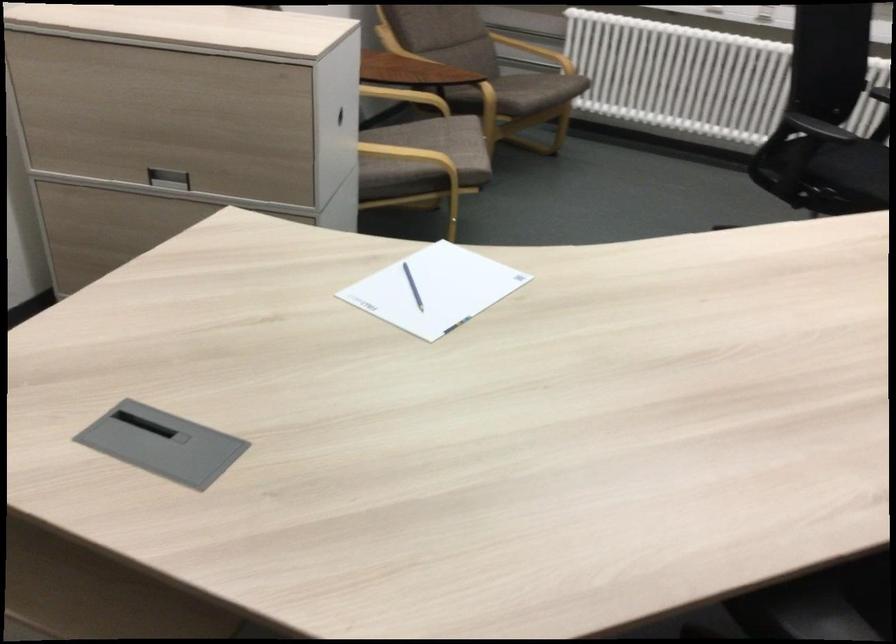
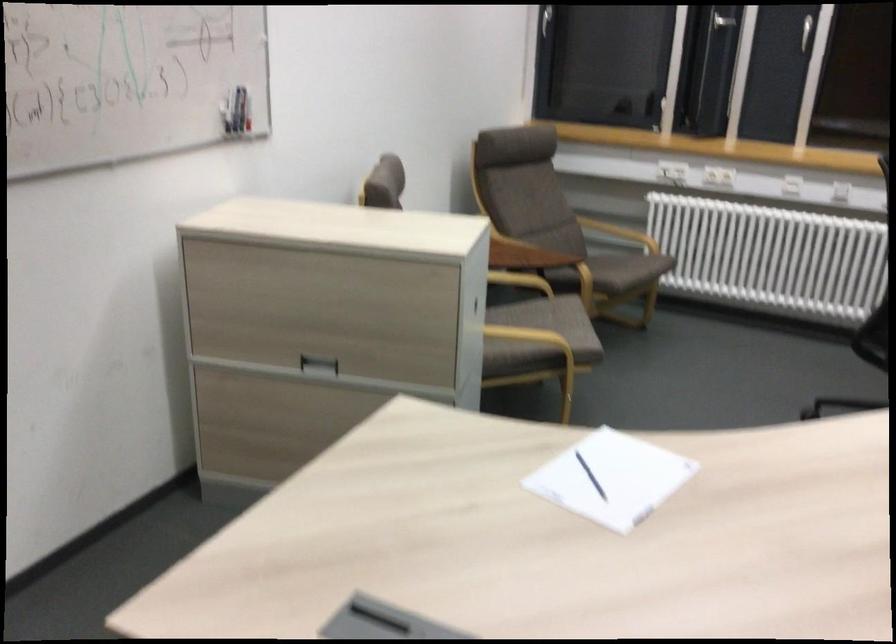
The point at (442, 144) is marked in the first image. Where is the corresponding point in the second image?

(552, 321)